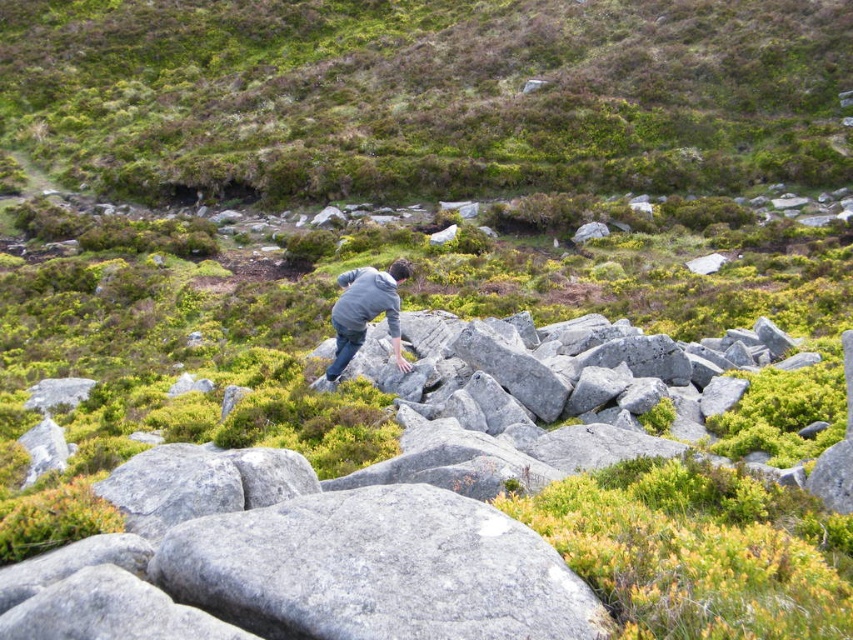
Between gray granite rock at center and gray matte jacket at center, which one is positioned lower?

Positioned lower is gray granite rock at center.

Can you confirm if gray granite rock at center is positioned above gray matte jacket at center?

No.

Is point (427, 493) farther from viewer compared to point (393, 314)?

No.

The image size is (853, 640). Find the location of `gray granite rock at center`. gray granite rock at center is located at coordinates (376, 570).

Looking at this image, can you confirm if green mossy hillside at upper center is bigger than gray matte jacket at center?

Yes, green mossy hillside at upper center is bigger than gray matte jacket at center.

From the picture: Between green mossy hillside at upper center and gray matte jacket at center, which one appears on the right side from the viewer's perspective?

gray matte jacket at center

Identify the location of green mossy hillside at upper center. pyautogui.click(x=424, y=93).

Does green mossy hillside at upper center have a lesser width compared to gray granite rock at center?

No.

Which is more to the left, green mossy hillside at upper center or gray granite rock at center?

From the viewer's perspective, green mossy hillside at upper center appears more on the left side.

The image size is (853, 640). I want to click on green mossy hillside at upper center, so click(424, 93).